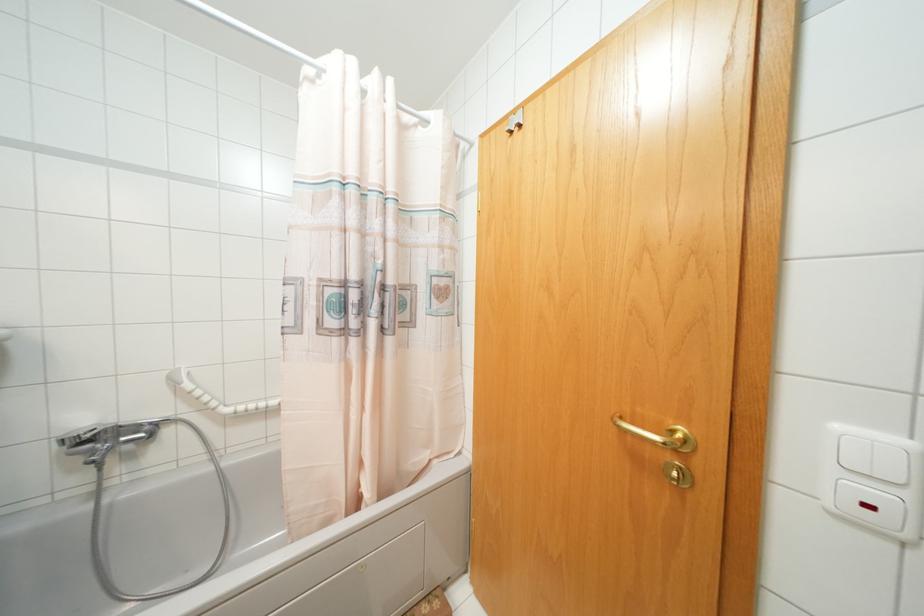
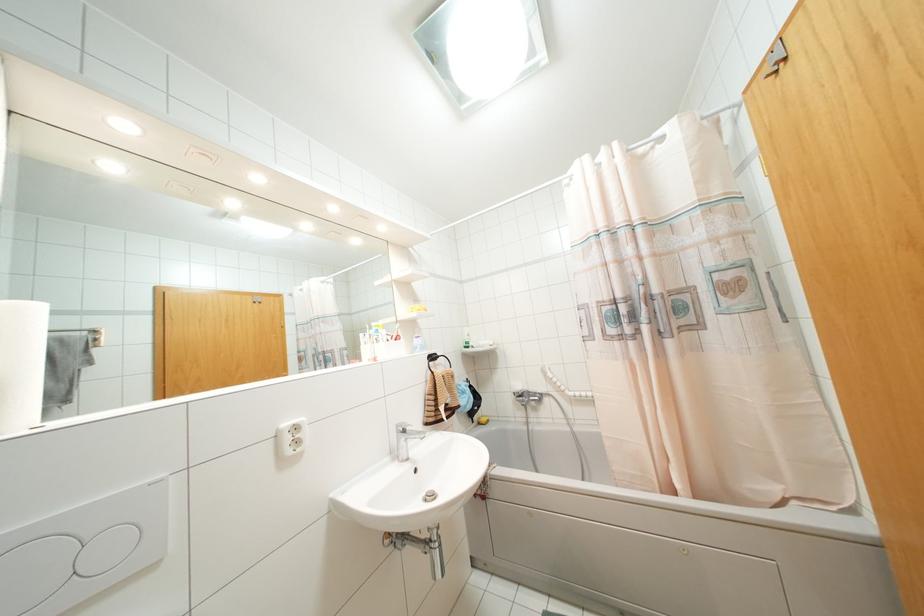
Where in the second image is the point corresponding to (518,126) from the first image?

(784, 58)